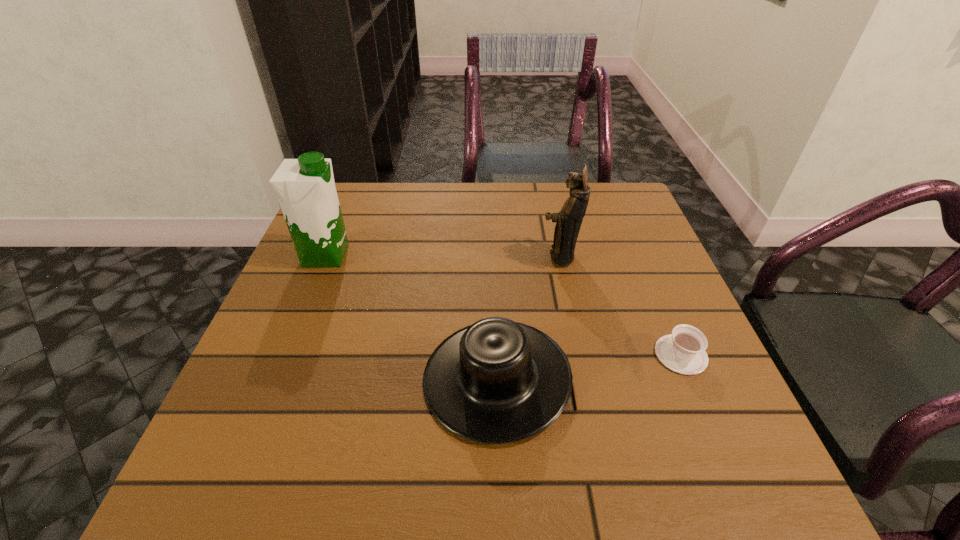
At what (x,y) coordinates should I click in order to perform the action: click on vacant space in between the rightmost object and the figurine. Please return your answer as a coordinate pair (x, y). The image size is (960, 540). Looking at the image, I should click on (620, 306).

The height and width of the screenshot is (540, 960). Identify the location of unoccupied area between the figurine and the soya milk. (443, 256).

Where is `vacant space that's between the figurine and the teacup`? vacant space that's between the figurine and the teacup is located at coordinates (620, 306).

Find the location of a particular element. This screenshot has height=540, width=960. vacant space that's between the rightmost object and the soya milk is located at coordinates (503, 305).

Find the location of a particular element. the closest object to the soya milk is located at coordinates (497, 381).

Locate an element on the screen. object that is the third closest to the teacup is located at coordinates (305, 187).

At what (x,y) coordinates should I click in order to perform the action: click on vacant space that satisfies the following two spatial constraints: 1. on the handle side of the teacup; 2. on the front-facing side of the soya milk. Please return your answer as a coordinate pair (x, y). The height and width of the screenshot is (540, 960). Looking at the image, I should click on (638, 255).

This screenshot has height=540, width=960. What are the coordinates of `vacant region that satisfies the following two spatial constraints: 1. on the front-facing side of the dress hat; 2. on the right side of the soya milk` in the screenshot? It's located at (276, 378).

You are a GUI agent. You are given a task and a screenshot of the screen. Output one action in this format:
    pyautogui.click(x=<x>, y=<y>)
    Task: Click on the free location that satisfies the following two spatial constraints: 1. on the front-facing side of the soya milk; 2. on the handle side of the rightmost object
    
    Given the screenshot: What is the action you would take?
    pyautogui.click(x=285, y=355)

Locate an element on the screen. This screenshot has width=960, height=540. free spot that satisfies the following two spatial constraints: 1. on the handle side of the teacup; 2. on the front-facing side of the leftmost object is located at coordinates (638, 255).